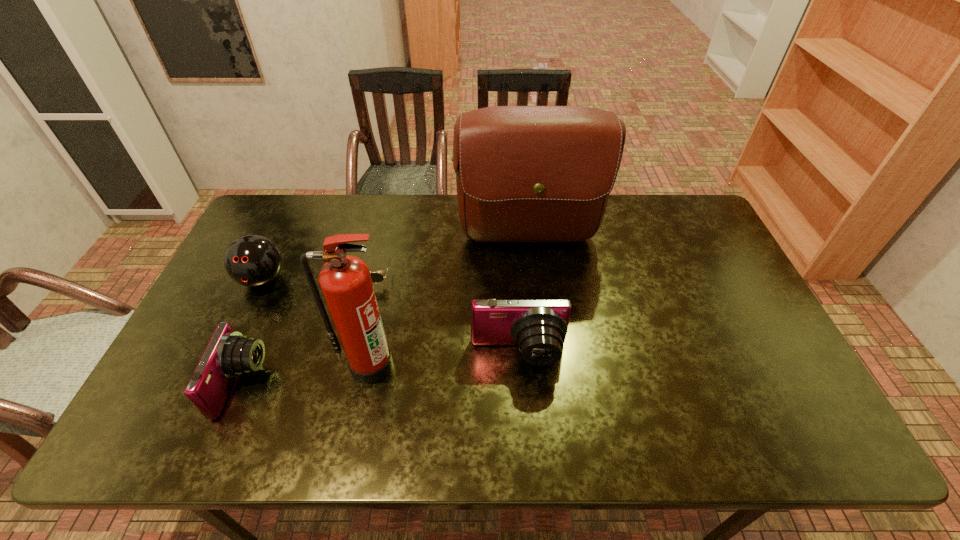
Image resolution: width=960 pixels, height=540 pixels. I want to click on blank region between the right camera and the shortest object, so click(444, 314).

Where is `vacant space that is in between the shortest object and the bowling ball`? This screenshot has width=960, height=540. vacant space that is in between the shortest object and the bowling ball is located at coordinates (316, 276).

This screenshot has height=540, width=960. Find the location of `free point between the fire extinguisher and the bowling ball`. free point between the fire extinguisher and the bowling ball is located at coordinates (317, 322).

In order to click on unoccupied area between the right camera and the shortest object in this screenshot , I will do `click(444, 314)`.

You are a GUI agent. You are given a task and a screenshot of the screen. Output one action in this format:
    pyautogui.click(x=<x>, y=<y>)
    Task: Click on the free space between the shortest object and the fifth tallest object
    Image resolution: width=960 pixels, height=540 pixels.
    Given the screenshot: What is the action you would take?
    pyautogui.click(x=305, y=329)

Identify the location of empty space between the sunglasses and the bowling ball. The width and height of the screenshot is (960, 540). (316, 276).

Locate an element on the screen. Image resolution: width=960 pixels, height=540 pixels. empty location between the shorter camera and the satchel is located at coordinates (385, 312).

Image resolution: width=960 pixels, height=540 pixels. In order to click on vacant area that lies between the fire extinguisher and the right camera in this screenshot , I will do `click(444, 360)`.

In order to click on free point between the satchel and the shortest object in this screenshot , I will do `click(448, 257)`.

I want to click on object that is the second closest to the second shortest object, so click(345, 280).